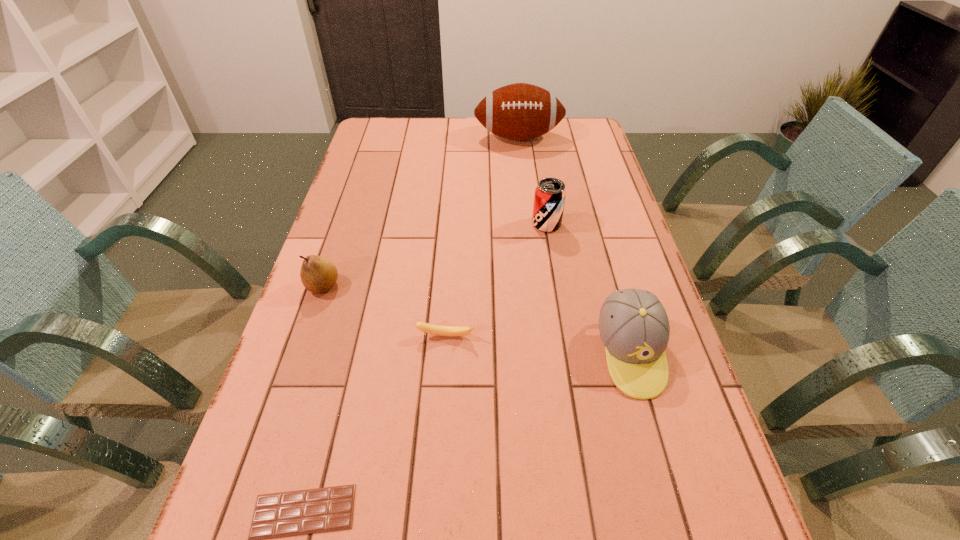
This screenshot has width=960, height=540. In the image, there is a desktop. In order to click on free space at the far right corner in this screenshot , I will do `click(563, 141)`.

Where is `free space between the soda can and the baseball cap`? free space between the soda can and the baseball cap is located at coordinates (588, 288).

The height and width of the screenshot is (540, 960). What are the coordinates of `vacant region between the baseball cap and the football` in the screenshot? It's located at (574, 245).

Locate an element on the screen. This screenshot has width=960, height=540. free space between the baseball cap and the second shortest object is located at coordinates [539, 345].

Find the location of a particular element. free space between the pear and the baseball cap is located at coordinates (477, 319).

At what (x,y) coordinates should I click in order to perform the action: click on free space between the fifth tallest object and the pear. Please return your answer as a coordinate pair (x, y). Looking at the image, I should click on (385, 311).

Identify the location of free area in between the fifth nearest object and the pear. The width and height of the screenshot is (960, 540). (435, 255).

Image resolution: width=960 pixels, height=540 pixels. In order to click on free space between the football and the soda can in this screenshot , I will do `click(533, 181)`.

Select which object appears as the fourth closest to the banana. Please provide its 2D coordinates. Your answer should be formatted as a tuple, i.e. [(x, y)], where the tuple contains the x and y coordinates of a point satisfying the conditions above.

[(549, 200)]

Identify which object is the nearest to the nearest object. Please provide its 2D coordinates. Your answer should be formatted as a tuple, i.e. [(x, y)], where the tuple contains the x and y coordinates of a point satisfying the conditions above.

[(428, 328)]